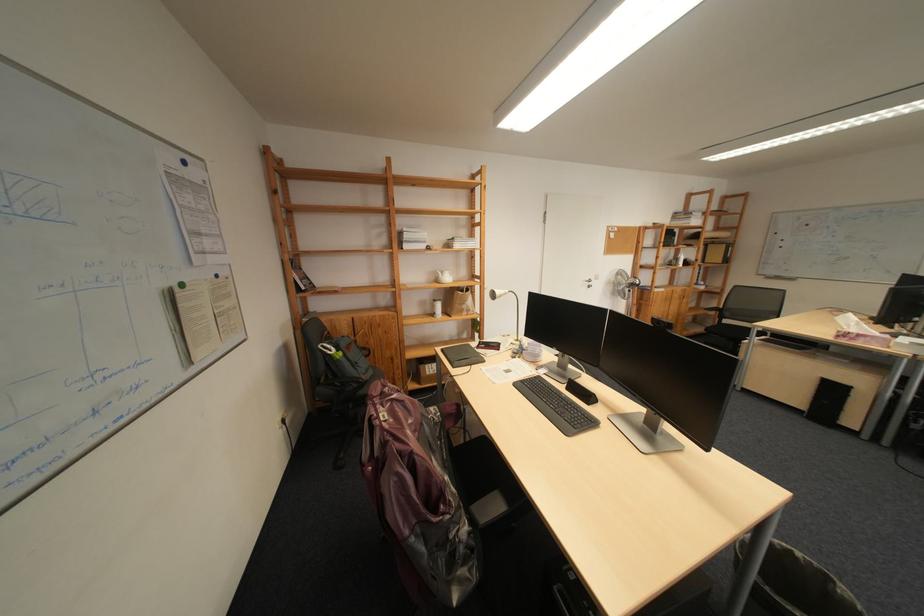
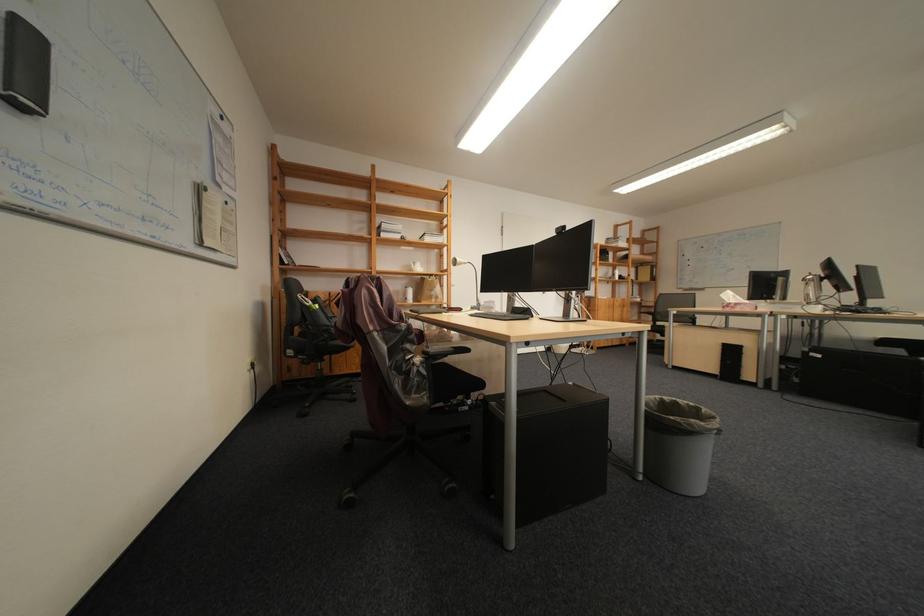
Find the pixel in the second image that matches (488,545) in the first image.

(440, 375)